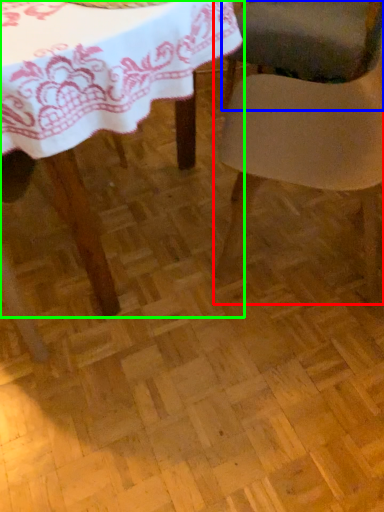
Question: Estimate the real-world distances between objects in this image. Which object is closer to chair (highlighted by a red box), chair (highlighted by a blue box) or table (highlighted by a green box)?

Choices:
 (A) chair
 (B) table

Answer: (B)